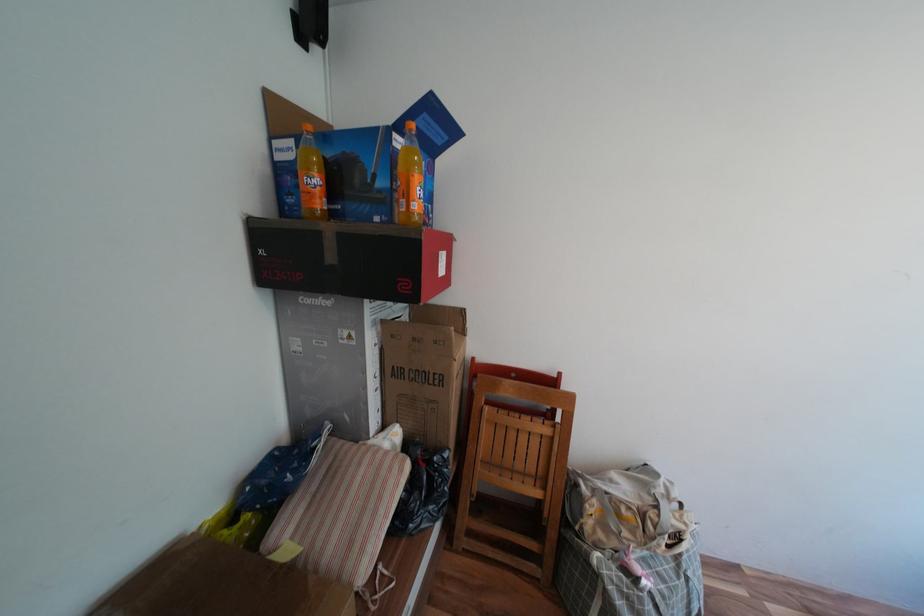
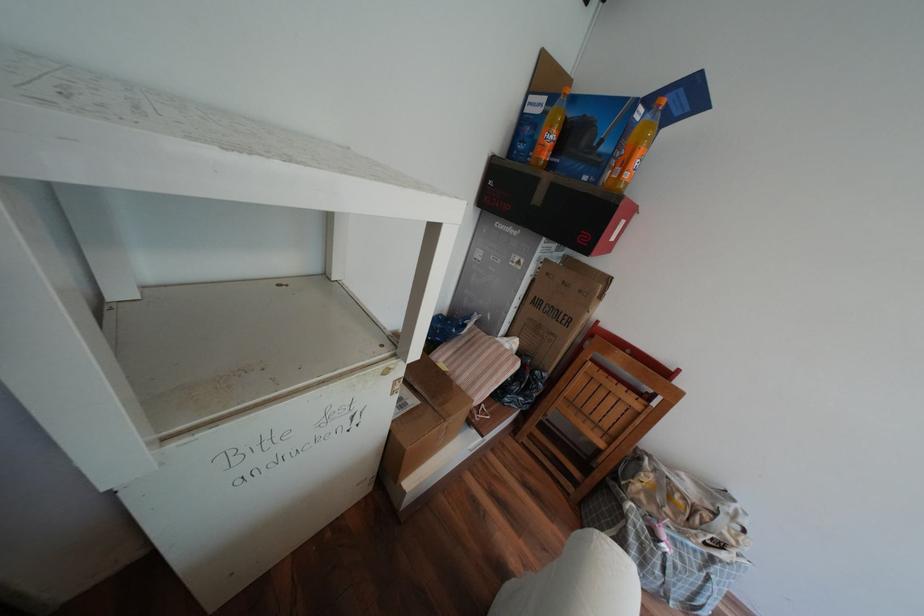
In the second image, find the point that corresponds to (x=400, y=190) in the first image.

(621, 156)